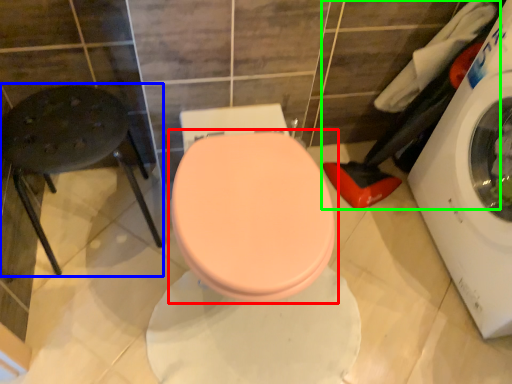
Question: Which is nearer to the toilet (highlighted by a red box)? bar stool (highlighted by a blue box) or laundry (highlighted by a green box).

Choices:
 (A) bar stool
 (B) laundry

Answer: (A)